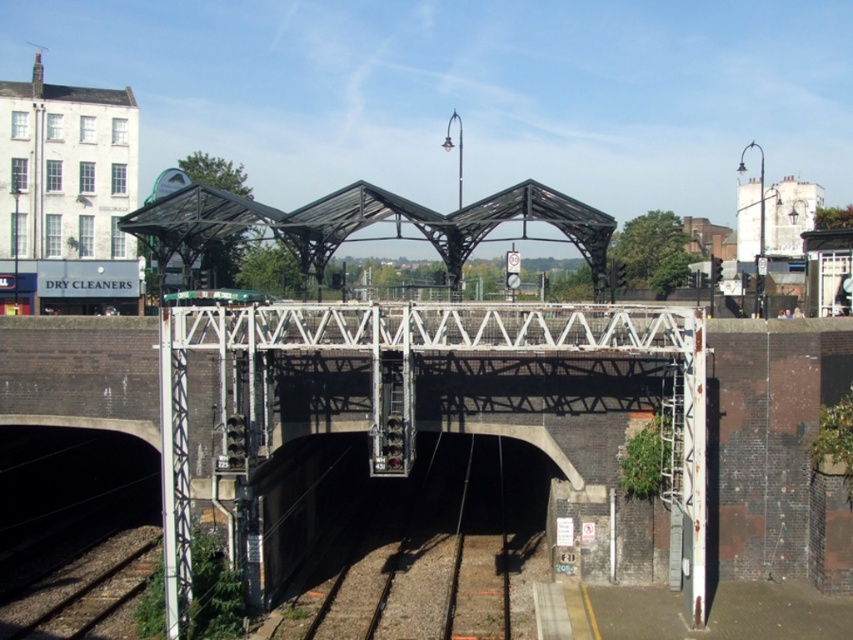
Between metallic/glass roof at center and green matte train at center, which one is positioned higher?

metallic/glass roof at center is above.

Can you confirm if metallic/glass roof at center is bigger than green matte train at center?

Correct, metallic/glass roof at center is larger in size than green matte train at center.

Which is behind, point (175, 214) or point (241, 291)?

Positioned behind is point (241, 291).

Locate an element on the screen. Image resolution: width=853 pixels, height=640 pixels. metallic/glass roof at center is located at coordinates (361, 225).

Does black metal train track at center appear on the right side of metallic/glass roof at center?

Correct, you'll find black metal train track at center to the right of metallic/glass roof at center.

Locate an element on the screen. black metal train track at center is located at coordinates (437, 552).

Can you confirm if black metal train track at center is taller than green matte train at center?

No, black metal train track at center is not taller than green matte train at center.

Can you confirm if black metal train track at center is shorter than green matte train at center?

Indeed, black metal train track at center has a lesser height compared to green matte train at center.

The width and height of the screenshot is (853, 640). In order to click on black metal train track at center in this screenshot , I will do `click(437, 552)`.

Identify the location of black metal train track at center. The height and width of the screenshot is (640, 853). (437, 552).